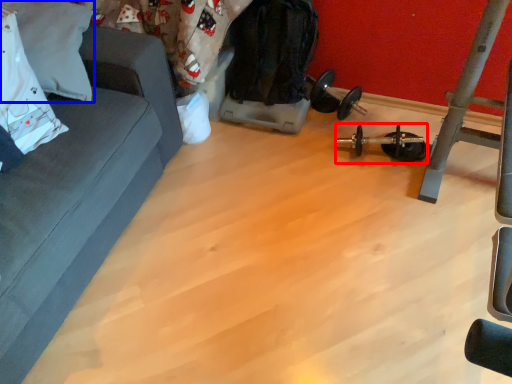
Question: Among these objects, which one is nearest to the camera, equipment (highlighted by a red box) or pillow (highlighted by a blue box)?

Choices:
 (A) equipment
 (B) pillow

Answer: (B)